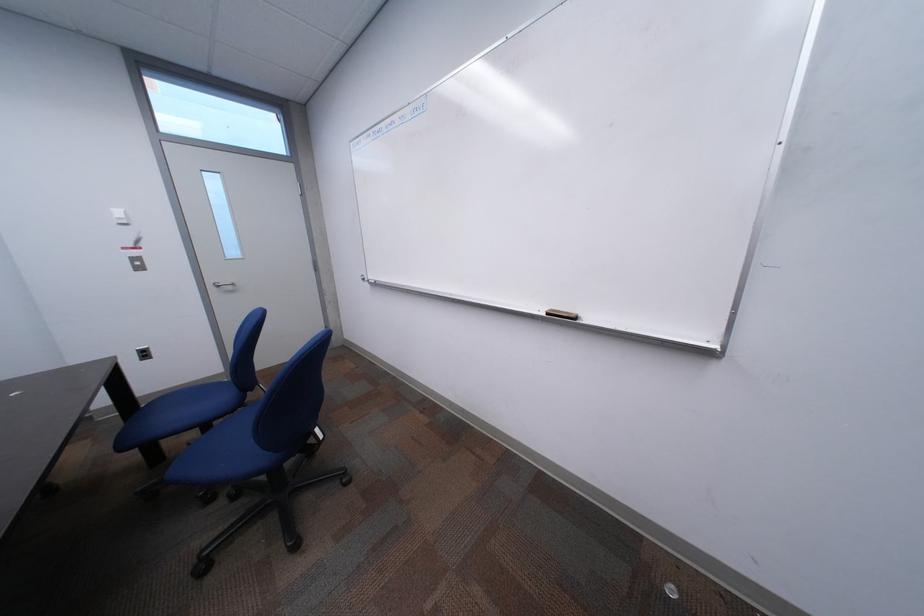
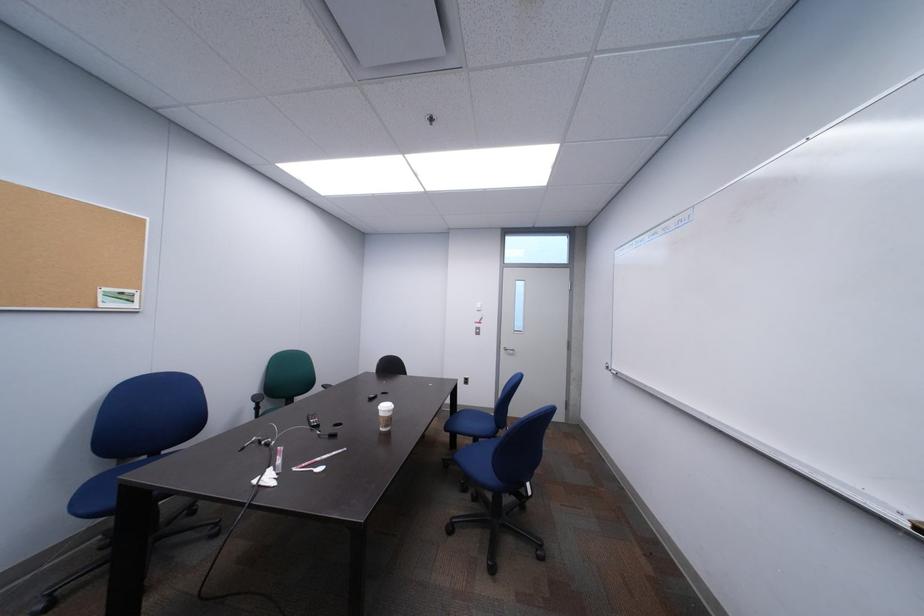
Question: The camera is either moving clockwise (left) or counter-clockwise (right) around the object. The first image is from the beginning of the video and the second image is from the end. Is the camera moving left or right when shooting the video?

Choices:
 (A) Left
 (B) Right

Answer: (B)